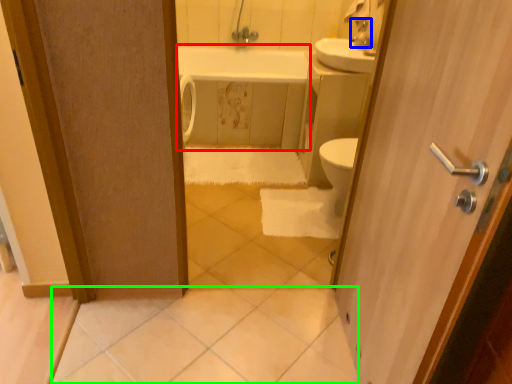
Question: Which object is the farthest from bath (highlighted by a red box)? Choose among these: faucet (highlighted by a blue box) or tile (highlighted by a green box).

Choices:
 (A) faucet
 (B) tile

Answer: (B)